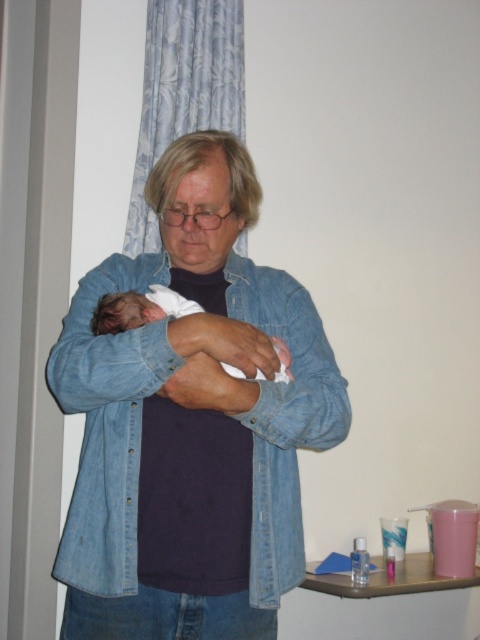
Question: Which of the following is the closest to the observer?

Choices:
 (A) (101, 298)
 (B) (273, 554)

Answer: (B)

Question: Does faded denim jacket at center appear under white soft newborn at center?

Choices:
 (A) yes
 (B) no

Answer: (A)

Question: Is faded denim jacket at center behind white soft newborn at center?

Choices:
 (A) yes
 (B) no

Answer: (B)

Question: Is faded denim jacket at center positioned in front of white soft newborn at center?

Choices:
 (A) yes
 (B) no

Answer: (A)